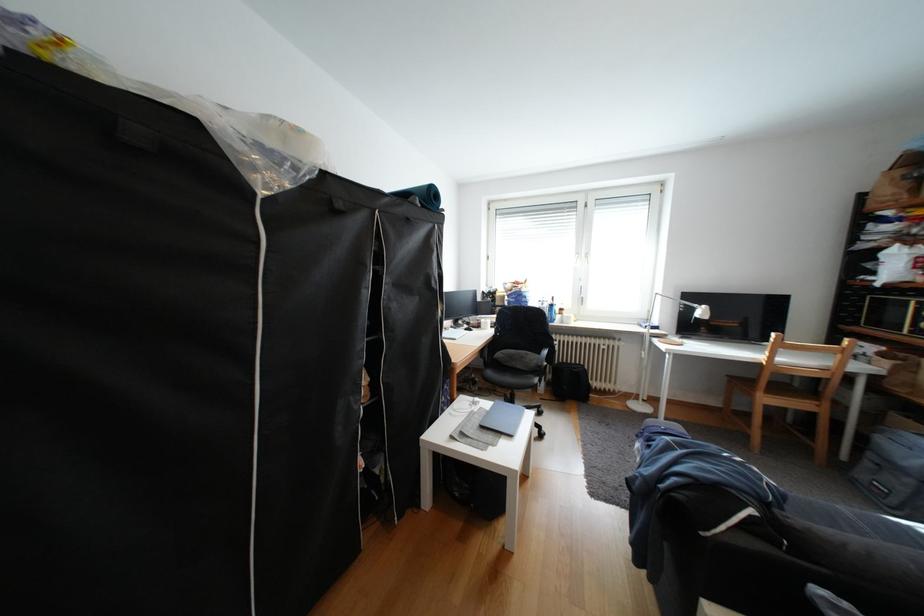
Find where to sit the wooden chair sitting surface. Please return your answer as a coordinate pair (x, y).

(777, 384)